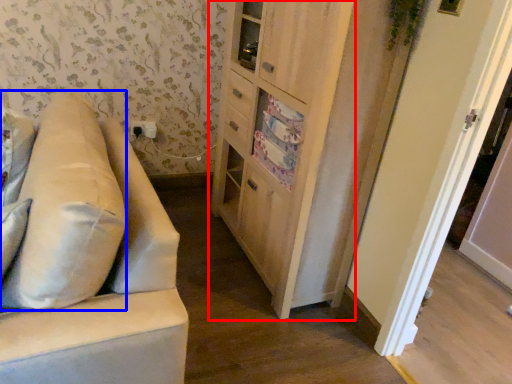
Question: Which object is closer to the camera taking this photo, cabinetry (highlighted by a red box) or pillow (highlighted by a blue box)?

Choices:
 (A) cabinetry
 (B) pillow

Answer: (B)